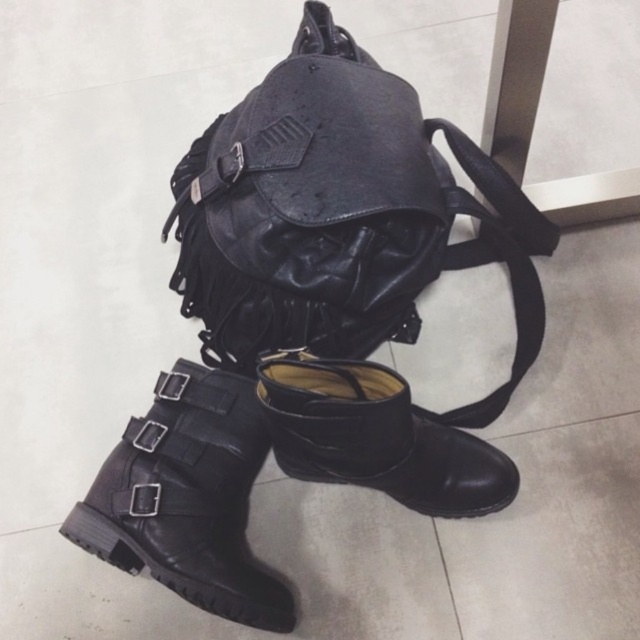
Question: Does black leather boot at lower left have a smaller size compared to black leather boot at lower center?

Choices:
 (A) no
 (B) yes

Answer: (B)

Question: Can you confirm if black leather boot at lower left is thinner than black leather boot at lower center?

Choices:
 (A) yes
 (B) no

Answer: (A)

Question: Is black leather boot at lower left closer to camera compared to black leather boot at lower center?

Choices:
 (A) yes
 (B) no

Answer: (B)

Question: Which point is closer to the camera taking this photo?

Choices:
 (A) (141, 440)
 (B) (404, 451)

Answer: (B)